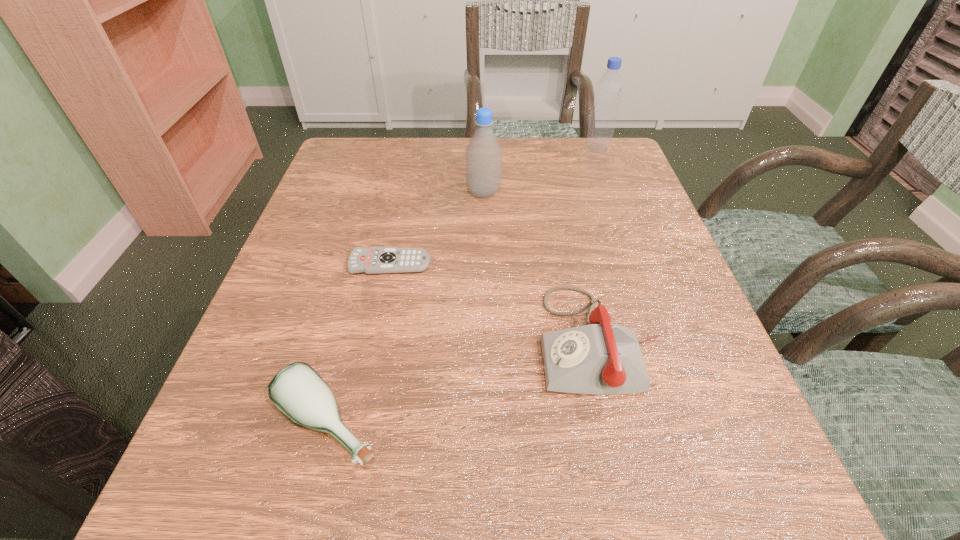
Select which object appears as the third closest to the fourth nearest object. Please provide its 2D coordinates. Your answer should be formatted as a tuple, i.e. [(x, y)], where the tuple contains the x and y coordinates of a point satisfying the conditions above.

[(598, 358)]

Identify the location of bottle that can be found as the closest to the leftmost bottle. (483, 155).

Select which bottle is the second closest to the telephone. Please provide its 2D coordinates. Your answer should be formatted as a tuple, i.e. [(x, y)], where the tuple contains the x and y coordinates of a point satisfying the conditions above.

[(483, 155)]

The width and height of the screenshot is (960, 540). In order to click on free location that satisfies the following two spatial constraints: 1. on the back side of the second farthest object; 2. on the right side of the shortest object in this screenshot , I will do `click(405, 192)`.